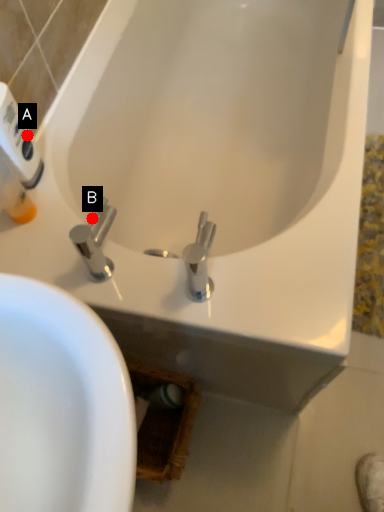
Question: Two points are circled on the image, labeled by A and B beside each circle. Which point is closer to the camera?

Choices:
 (A) A is closer
 (B) B is closer

Answer: (B)